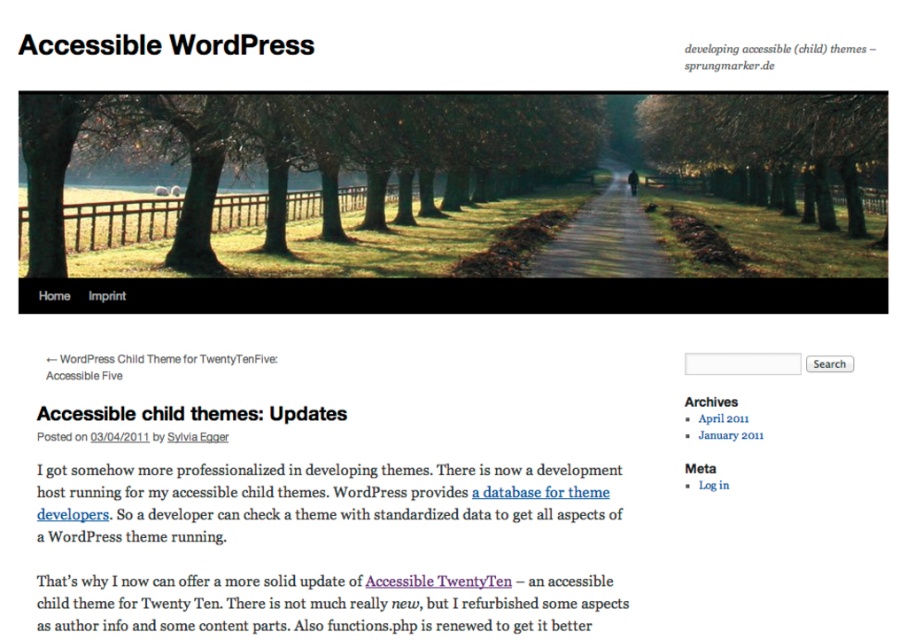
Question: Which point appears closest to the camera in this image?

Choices:
 (A) (327, 116)
 (B) (611, 170)
 (C) (639, 125)

Answer: (A)

Question: Which object is closer to the camera taking this photo?

Choices:
 (A) green matte tree at center
 (B) brown textured tree at center

Answer: (A)

Question: Is brown textured tree at center below brown dirt path at center?

Choices:
 (A) no
 (B) yes

Answer: (A)

Question: Is brown textured tree at center smaller than brown dirt path at center?

Choices:
 (A) no
 (B) yes

Answer: (A)

Question: Observing the image, what is the correct spatial positioning of green matte tree at center in reference to brown textured tree at center?

Choices:
 (A) below
 (B) above

Answer: (A)

Question: Estimate the real-world distances between objects in this image. Which object is farther from the brown textured tree at center?

Choices:
 (A) brown dirt path at center
 (B) green matte tree at center

Answer: (B)